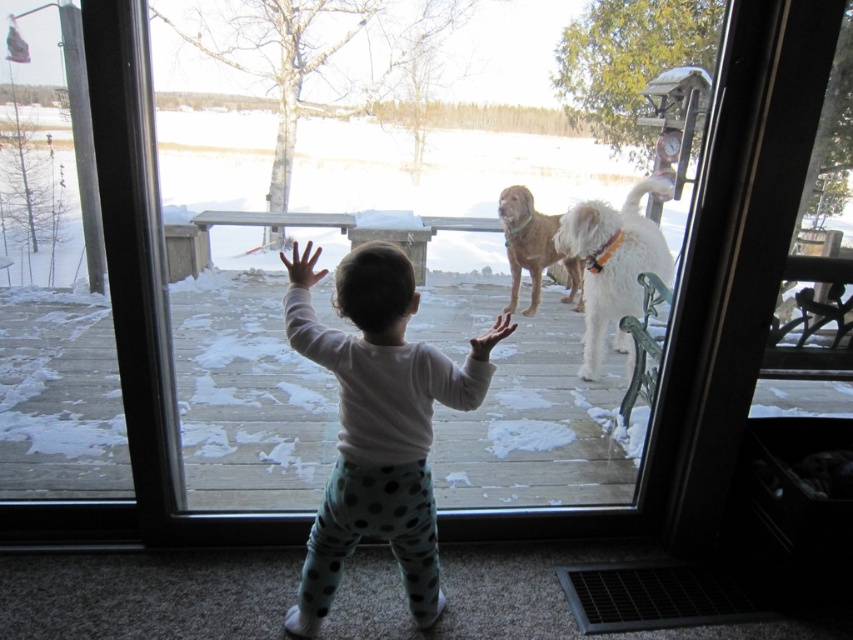
Does transparent glass window at center appear on the left side of golden brown fur at center?

Indeed, transparent glass window at center is positioned on the left side of golden brown fur at center.

Who is more distant from viewer, (x=131, y=88) or (x=514, y=189)?

Positioned behind is point (x=514, y=189).

Locate an element on the screen. Image resolution: width=853 pixels, height=640 pixels. transparent glass window at center is located at coordinates (135, 317).

Who is more forward, (662, 192) or (523, 257)?

Positioned in front is point (662, 192).

Find the location of a particular element. white fluffy dog at right is located at coordinates coord(613,264).

Identify the location of white fluffy dog at right. The image size is (853, 640). (613, 264).

Who is positioned more to the right, transparent glass window at center or white soft toddler at center?

Positioned to the right is white soft toddler at center.

Describe the element at coordinates (135, 317) in the screenshot. The image size is (853, 640). I see `transparent glass window at center` at that location.

Does point (107, 531) come closer to viewer compared to point (363, 486)?

No, it is not.

Where is `transparent glass window at center`? This screenshot has width=853, height=640. transparent glass window at center is located at coordinates (135, 317).